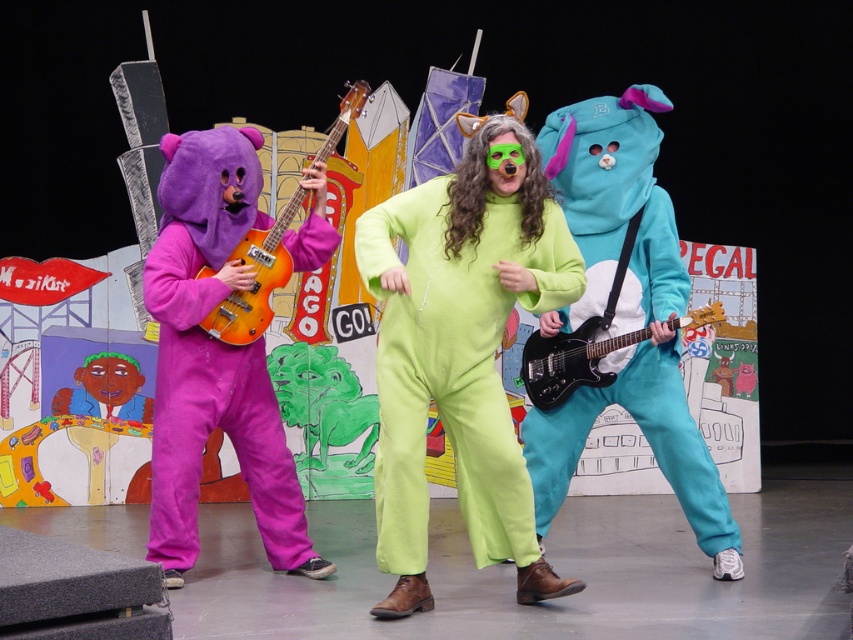
Between purple fleece bear at left and orange glossy guitar at left, which one appears on the right side from the viewer's perspective?

From the viewer's perspective, orange glossy guitar at left appears more on the right side.

Who is more distant from viewer, (x=158, y=355) or (x=276, y=237)?

The point (x=276, y=237) is more distant.

In order to click on purple fleece bear at left in this screenshot , I will do `click(213, 356)`.

The image size is (853, 640). Describe the element at coordinates (624, 314) in the screenshot. I see `teal plush onesie at center` at that location.

Looking at this image, can you confirm if teal plush onesie at center is positioned to the right of black glossy electric guitar at center?

No, teal plush onesie at center is not to the right of black glossy electric guitar at center.

Does point (660, 396) come in front of point (543, 410)?

That is True.

The width and height of the screenshot is (853, 640). In order to click on teal plush onesie at center in this screenshot , I will do pos(624,314).

Who is positioned more to the left, purple fleece bear at left or black glossy electric guitar at center?

purple fleece bear at left is more to the left.

Looking at this image, who is more forward, (x=178, y=384) or (x=570, y=355)?

Point (x=178, y=384) is in front.

Does point (252, 477) come behind point (556, 368)?

Yes, it is.

Locate an element on the screen. purple fleece bear at left is located at coordinates (213, 356).